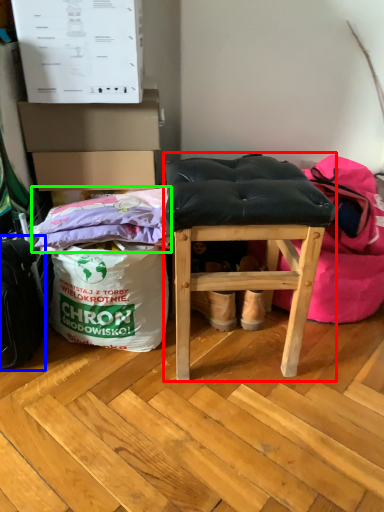
Question: Based on their relative distances, which object is farther from furniture (highlighted by a red box)? Choose from messenger bag (highlighted by a blue box) and material (highlighted by a green box).

Choices:
 (A) messenger bag
 (B) material

Answer: (A)